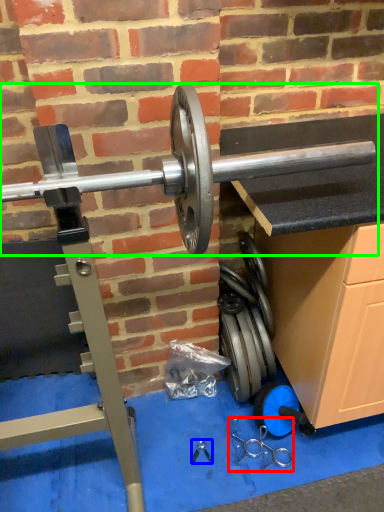
Question: Considering the real-world distances, which object is closest to tool (highlighted by a red box)? tool (highlighted by a blue box) or barbell (highlighted by a green box).

Choices:
 (A) tool
 (B) barbell

Answer: (A)